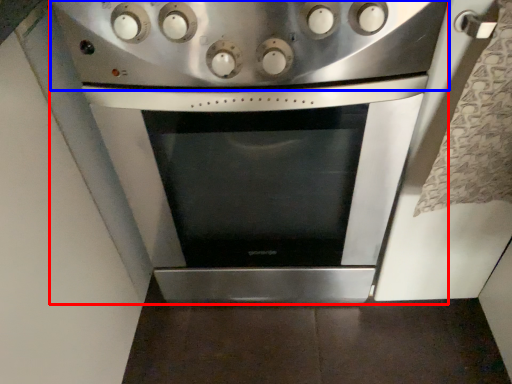
Question: Which object is further to the camera taking this photo, kitchen appliance (highlighted by a red box) or gas stove (highlighted by a blue box)?

Choices:
 (A) kitchen appliance
 (B) gas stove

Answer: (A)